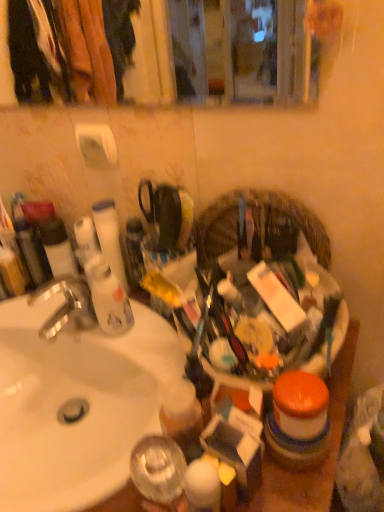
Question: Are matte black tube at left and plastic woven basket at center far apart?

Choices:
 (A) no
 (B) yes

Answer: (A)

Question: Is matte black tube at left smaller than plastic woven basket at center?

Choices:
 (A) no
 (B) yes

Answer: (B)

Question: Could you tell me if matte black tube at left is facing plastic woven basket at center?

Choices:
 (A) no
 (B) yes

Answer: (A)

Question: Considering the relative sizes of matte black tube at left and plastic woven basket at center in the image provided, is matte black tube at left taller than plastic woven basket at center?

Choices:
 (A) yes
 (B) no

Answer: (B)

Question: From a real-world perspective, is matte black tube at left physically above plastic woven basket at center?

Choices:
 (A) no
 (B) yes

Answer: (A)

Question: From the image's perspective, is plastic woven basket at center positioned above or below silver metallic faucet at left?

Choices:
 (A) above
 (B) below

Answer: (A)

Question: Do you think plastic woven basket at center is within silver metallic faucet at left, or outside of it?

Choices:
 (A) inside
 (B) outside

Answer: (B)

Question: Considering the positions of point (235, 226) and point (54, 324), is point (235, 226) closer or farther from the camera than point (54, 324)?

Choices:
 (A) closer
 (B) farther

Answer: (A)

Question: Is plastic woven basket at center in front of or behind silver metallic faucet at left in the image?

Choices:
 (A) behind
 (B) front

Answer: (B)

Question: Relative to matte black tube at left, is silver metallic faucet at left in front or behind?

Choices:
 (A) behind
 (B) front

Answer: (B)

Question: Is silver metallic faucet at left taller or shorter than matte black tube at left?

Choices:
 (A) short
 (B) tall

Answer: (A)

Question: Is silver metallic faucet at left bigger or smaller than matte black tube at left?

Choices:
 (A) small
 (B) big

Answer: (B)

Question: Does point (49, 289) appear closer or farther from the camera than point (59, 275)?

Choices:
 (A) closer
 (B) farther

Answer: (A)

Question: In terms of width, does white glossy sink at left look wider or thinner when compared to silver metallic faucet at left?

Choices:
 (A) thin
 (B) wide

Answer: (B)

Question: Considering their positions, is white glossy sink at left located in front of or behind silver metallic faucet at left?

Choices:
 (A) front
 (B) behind

Answer: (A)